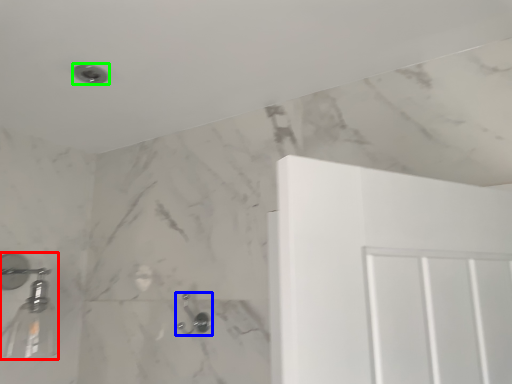
Question: Based on their relative distances, which object is farther from shower (highlighted by a red box)? Choose from shower (highlighted by a blue box) and shower (highlighted by a green box).

Choices:
 (A) shower
 (B) shower

Answer: (B)